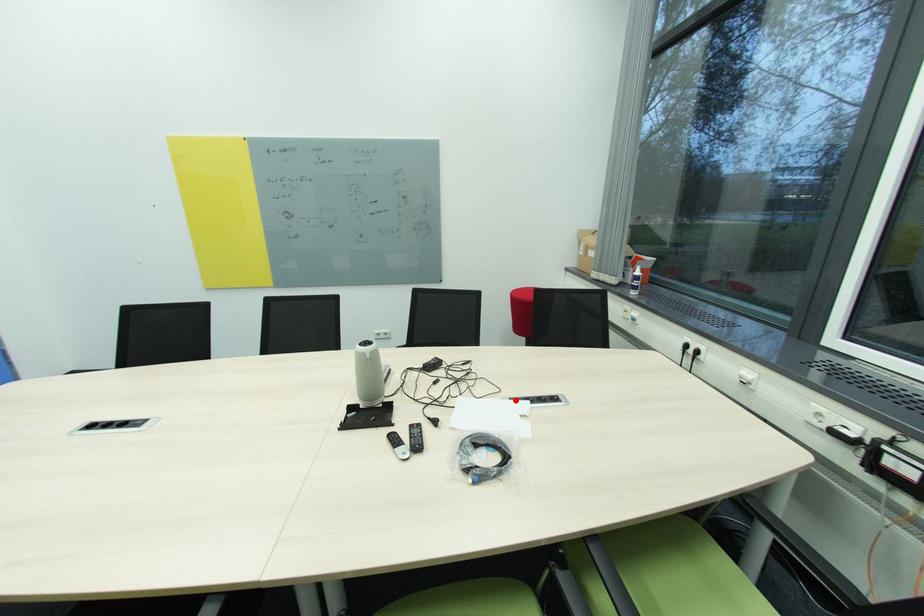
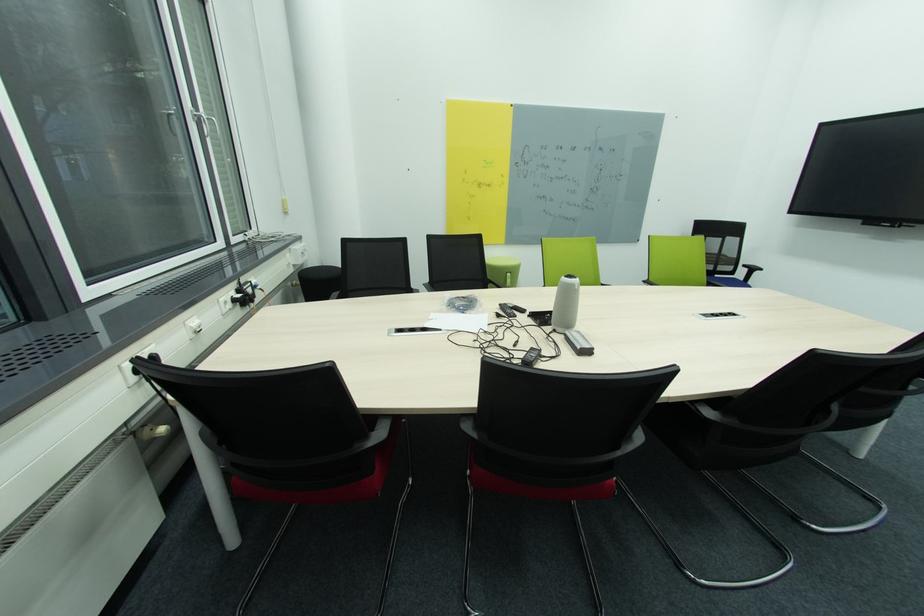
In the second image, find the point that corresponds to the highlighted location in the first image.

(444, 331)